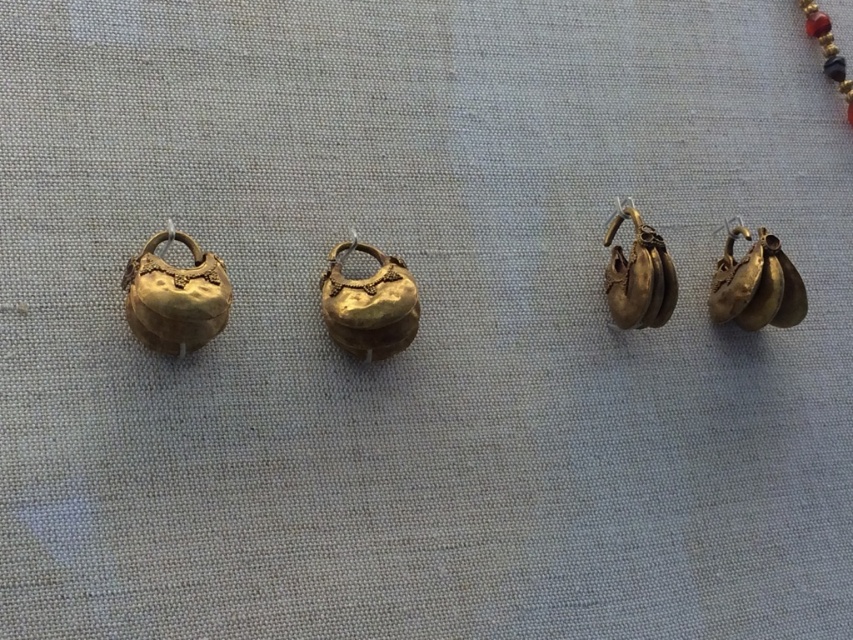
You are an archaeologist examining the artifacts. You need to determine which object is wider between the gold shiny bell at center and the gold shiny earrings at right. Based on their positions and the scene, what can you conclude?

The gold shiny bell at center is wider than the gold shiny earrings at right according to the description.

You are an archaeologist examining the artifacts. Which object is closer to you between the gold shiny bell at center and the gold shiny earrings at right?

The gold shiny bell at center is closer to you as it is positioned in front of the gold shiny earrings at right.